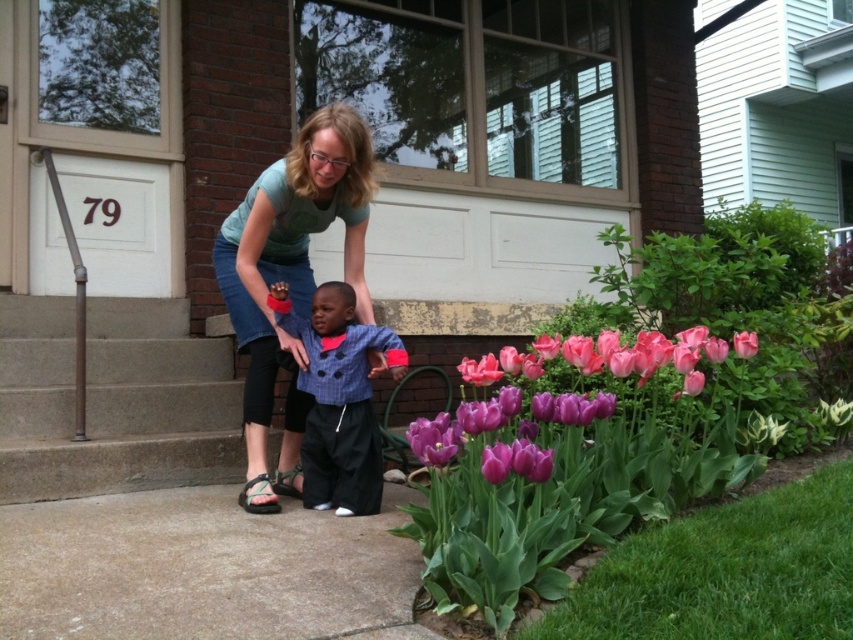
In the scene shown: You are standing in the garden and want to place a small potted plant between the concrete at left and the blue textured shirt at center. Based on their positions, where should you place the potted plant?

The concrete at left is positioned under the blue textured shirt at center, so you should place the potted plant between them horizontally, ensuring it is aligned with both objects.

You are planning to place a small garden statue that is 1 meter wide in the scene. You want to place it on the concrete at left or the purple matte tulip at lower center. Which area can accommodate the statue based on their widths?

The concrete at left has a larger width than the purple matte tulip at lower center, so the statue can be placed on the concrete at left.